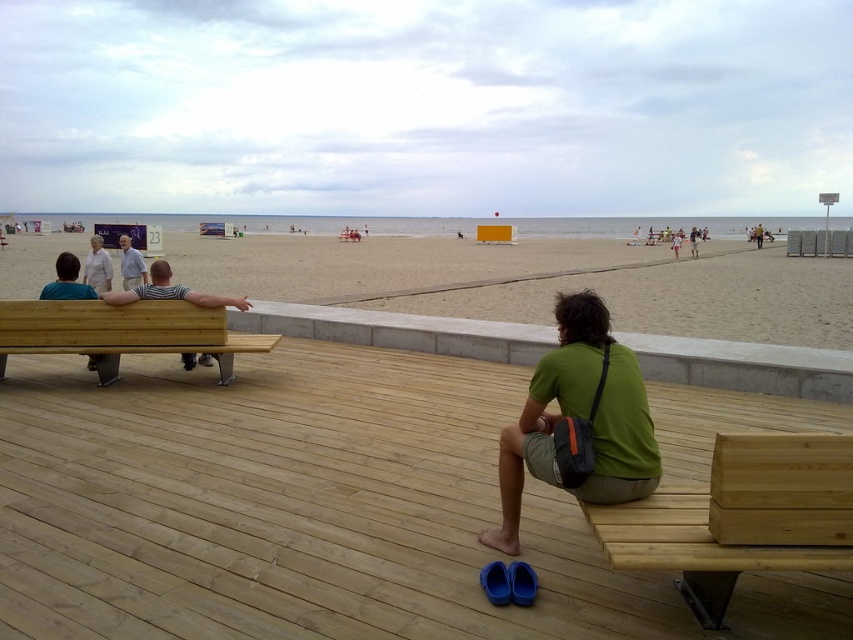
From the picture: You are standing on the wooden boardwalk and want to hand a brochure to both the striped cotton shirt at left and the gray fabric shirt at left. If you can reach 2 meters, will you be able to hand both without moving?

The striped cotton shirt at left is 2.23 meters away from gray fabric shirt at left. Since your reach is 2 meters, you cannot hand both without moving because the distance between them exceeds your reach.

You are standing on the wooden boardwalk and see the green fabric bag at lower center and the light brown wooden bench at left. Which object is positioned to the right of the other?

The green fabric bag at lower center is to the right of the light brown wooden bench at left.

You are standing at the position of the viewer in the scene. There is a striped cotton shirt at left. Can you reach it without moving more than 5 meters?

The striped cotton shirt at left and the viewer are 5.72 meters apart. Since 5.72 meters is more than 5 meters, you cannot reach it without moving more than 5 meters.